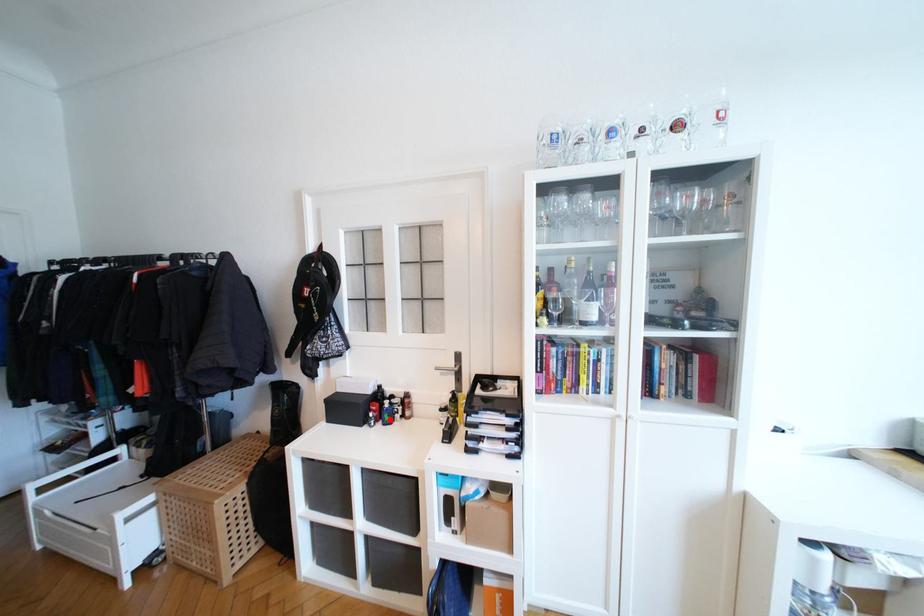
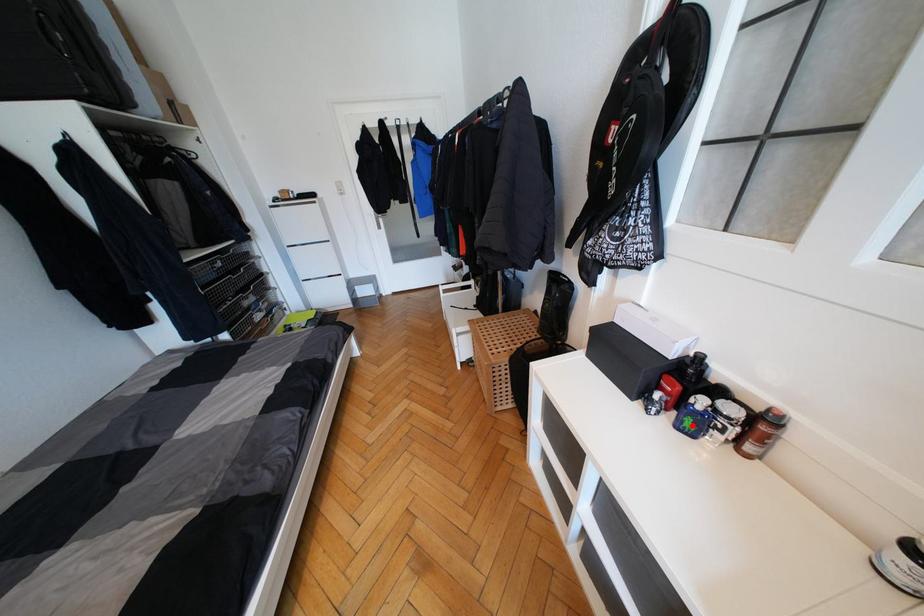
I am providing you with two images of the same scene from different viewpoints. A red point is marked on the first image and another point is marked on the second image. Is the marked point in image1 the same physical position as the marked point in image2?

Yes